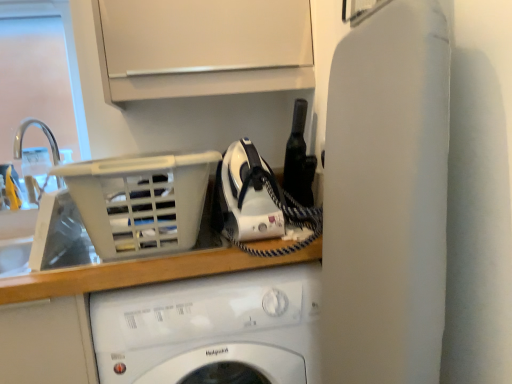
Question: Considering the relative sizes of white plastic basket at upper left and white plastic sink at left in the image provided, is white plastic basket at upper left wider than white plastic sink at left?

Choices:
 (A) no
 (B) yes

Answer: (B)

Question: Can you confirm if white plastic basket at upper left is smaller than white plastic sink at left?

Choices:
 (A) no
 (B) yes

Answer: (A)

Question: Is white plastic basket at upper left closer to the viewer compared to white plastic sink at left?

Choices:
 (A) no
 (B) yes

Answer: (B)

Question: Is white plastic sink at left surrounded by white plastic basket at upper left?

Choices:
 (A) yes
 (B) no

Answer: (B)

Question: Is white plastic basket at upper left turned away from white plastic sink at left?

Choices:
 (A) no
 (B) yes

Answer: (A)

Question: Can you confirm if white plastic basket at upper left is bigger than white plastic sink at left?

Choices:
 (A) yes
 (B) no

Answer: (A)

Question: Is white glossy washing machine at center taller than white plastic sink at left?

Choices:
 (A) yes
 (B) no

Answer: (A)

Question: Are white glossy washing machine at center and white plastic sink at left far apart?

Choices:
 (A) no
 (B) yes

Answer: (A)

Question: From a real-world perspective, is white glossy washing machine at center located higher than white plastic sink at left?

Choices:
 (A) no
 (B) yes

Answer: (A)

Question: Is white glossy washing machine at center beside white plastic sink at left?

Choices:
 (A) yes
 (B) no

Answer: (B)

Question: Would you say white plastic sink at left is part of white glossy washing machine at center's contents?

Choices:
 (A) no
 (B) yes

Answer: (A)

Question: Is white glossy washing machine at center facing towards white plastic sink at left?

Choices:
 (A) no
 (B) yes

Answer: (A)

Question: Is white plastic sink at left touching white plastic basket at upper left?

Choices:
 (A) yes
 (B) no

Answer: (B)